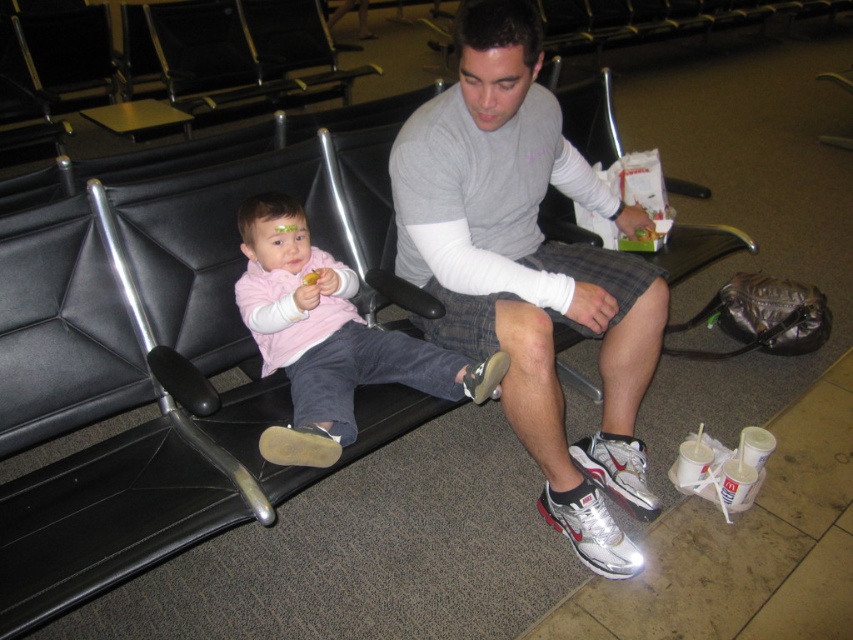
Question: Which point is farther from the camera taking this photo?

Choices:
 (A) (519, 310)
 (B) (354, 273)

Answer: (B)

Question: Is gray cotton shirt at center bigger than pink fleece sweater at center?

Choices:
 (A) yes
 (B) no

Answer: (A)

Question: Does gray cotton shirt at center appear on the right side of pink fleece sweater at center?

Choices:
 (A) yes
 (B) no

Answer: (A)

Question: Does gray cotton shirt at center appear on the left side of pink fleece sweater at center?

Choices:
 (A) no
 (B) yes

Answer: (A)